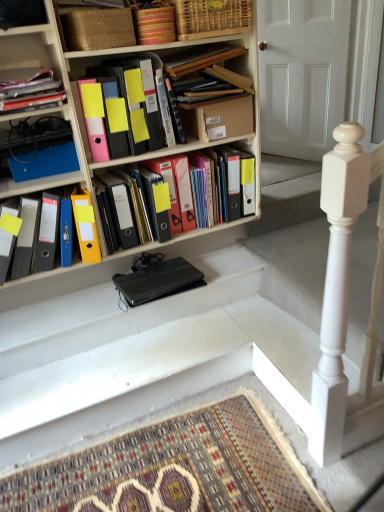
Question: Considering the relative positions of yellow matte folder at center, which appears as the 4th book when viewed from the top, and black matte laptop at center in the image provided, is yellow matte folder at center, which appears as the 4th book when viewed from the top, to the right of black matte laptop at center from the viewer's perspective?

Choices:
 (A) yes
 (B) no

Answer: (A)

Question: Can you confirm if yellow matte folder at center, which appears as the 4th book when viewed from the top, is shorter than black matte laptop at center?

Choices:
 (A) no
 (B) yes

Answer: (A)

Question: From the image's perspective, would you say yellow matte folder at center, the 2th book in the bottom-to-top sequence, is positioned over black matte laptop at center?

Choices:
 (A) no
 (B) yes

Answer: (B)

Question: Is yellow matte folder at center, the 2th book in the bottom-to-top sequence, positioned with its back to black matte laptop at center?

Choices:
 (A) yes
 (B) no

Answer: (B)

Question: Can you confirm if yellow matte folder at center, the 2th book in the bottom-to-top sequence, is positioned to the left of black matte laptop at center?

Choices:
 (A) yes
 (B) no

Answer: (B)

Question: Which is correct: matte black folder at upper left, the third book from the bottom, is inside yellow matte folder at center, which appears as the 4th book when viewed from the top, or outside of it?

Choices:
 (A) outside
 (B) inside

Answer: (A)

Question: Is matte black folder at upper left, the 3th book viewed from the top, in front of or behind yellow matte folder at center, the 2th book in the bottom-to-top sequence, in the image?

Choices:
 (A) behind
 (B) front

Answer: (B)

Question: From the image's perspective, is matte black folder at upper left, the third book from the bottom, above or below yellow matte folder at center, the 2th book in the bottom-to-top sequence?

Choices:
 (A) above
 (B) below

Answer: (A)

Question: Is matte black folder at upper left, the third book from the bottom, wider or thinner than yellow matte folder at center, which appears as the 4th book when viewed from the top?

Choices:
 (A) thin
 (B) wide

Answer: (A)

Question: Is white wooden door at upper center taller or shorter than matte black folder at upper left, the third book from the bottom?

Choices:
 (A) tall
 (B) short

Answer: (A)

Question: In the image, is white wooden door at upper center on the left side or the right side of matte black folder at upper left, the 3th book viewed from the top?

Choices:
 (A) left
 (B) right

Answer: (B)

Question: Looking at the image, does white wooden door at upper center seem bigger or smaller compared to matte black folder at upper left, the 3th book viewed from the top?

Choices:
 (A) small
 (B) big

Answer: (B)

Question: Does point (306, 140) appear closer or farther from the camera than point (11, 99)?

Choices:
 (A) farther
 (B) closer

Answer: (A)

Question: Considering the positions of point (185, 155) and point (57, 234), is point (185, 155) closer or farther from the camera than point (57, 234)?

Choices:
 (A) closer
 (B) farther

Answer: (B)

Question: From a real-world perspective, is yellow matte folder at center, which appears as the 4th book when viewed from the top, positioned above or below matte plastic folders at left, the 1th book in the bottom-to-top sequence?

Choices:
 (A) below
 (B) above

Answer: (B)